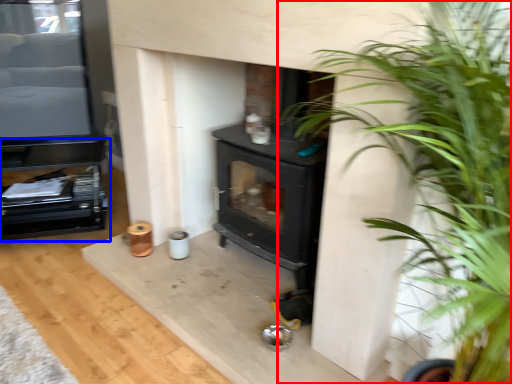
Question: Which of the following is the closest to the observer, houseplant (highlighted by a red box) or entertainment center (highlighted by a blue box)?

Choices:
 (A) houseplant
 (B) entertainment center

Answer: (A)